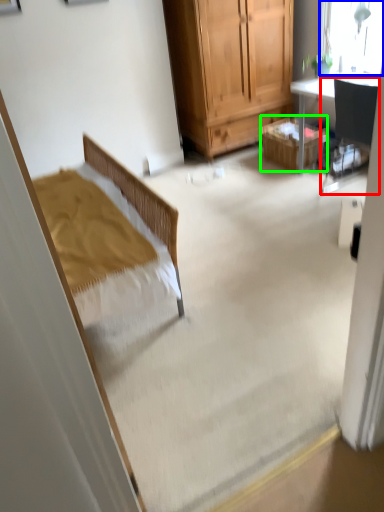
Question: Which object is positioned closest to chair (highlighted by a red box)? Select from window (highlighted by a blue box) and picnic basket (highlighted by a green box).

Choices:
 (A) window
 (B) picnic basket

Answer: (A)